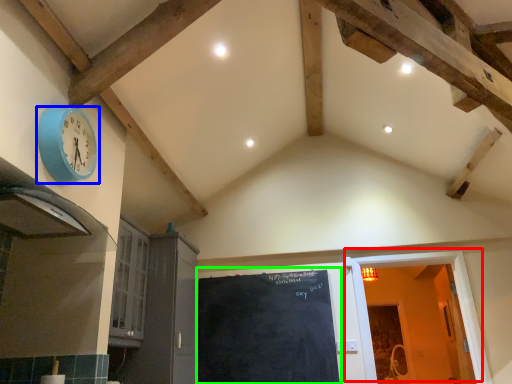
Question: Estimate the real-world distances between objects in this image. Which object is closer to door (highlighted by a red box), wall clock (highlighted by a blue box) or bulletin board (highlighted by a green box)?

Choices:
 (A) wall clock
 (B) bulletin board

Answer: (B)